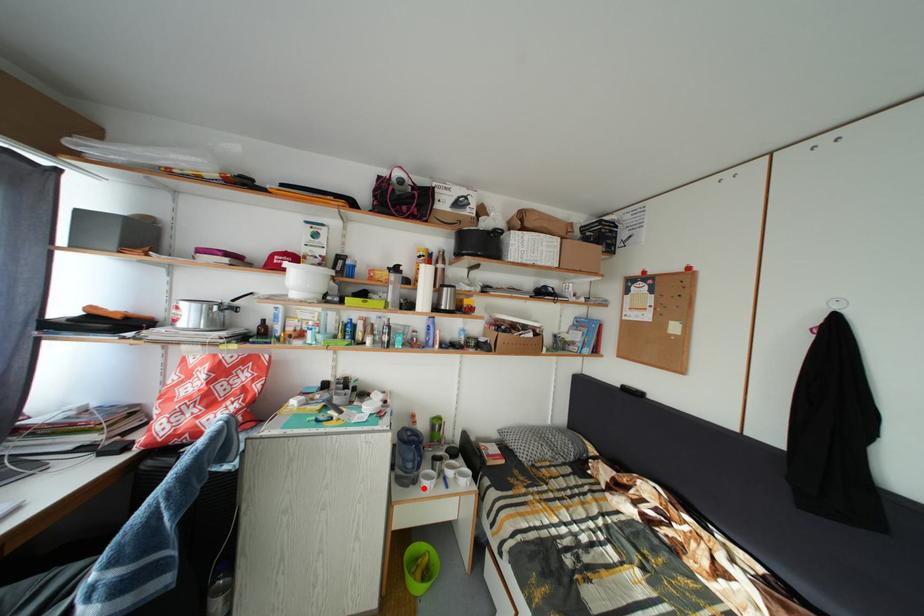
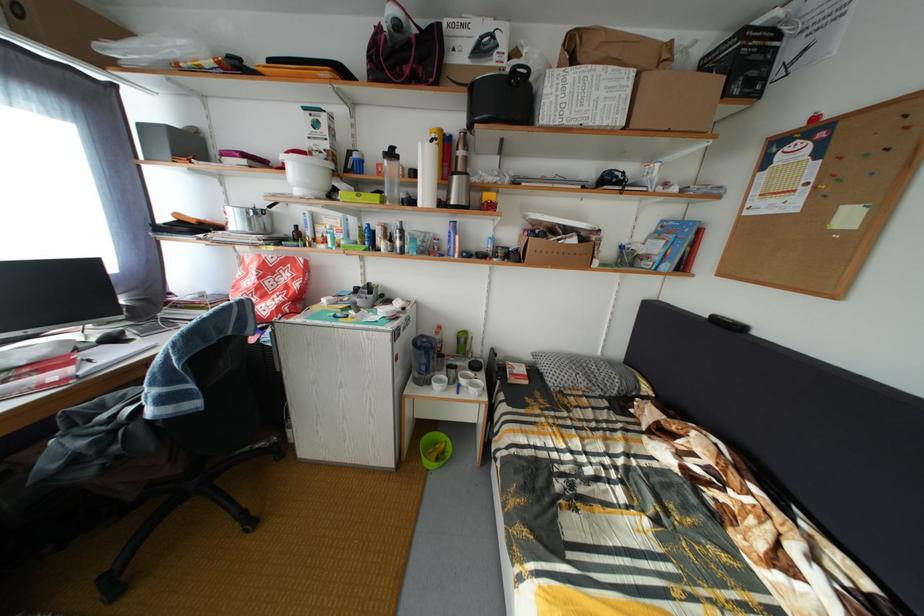
Find the pixel in the second image that matches the highlighted location in the first image.

(438, 390)